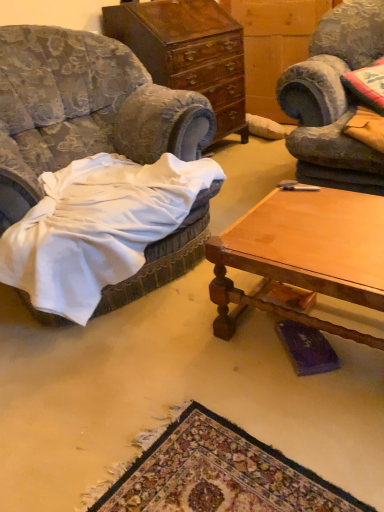
Locate an element on the screen. free space above wooden polished coffee table at center (from a real-world perspective) is located at coordinates (314, 228).